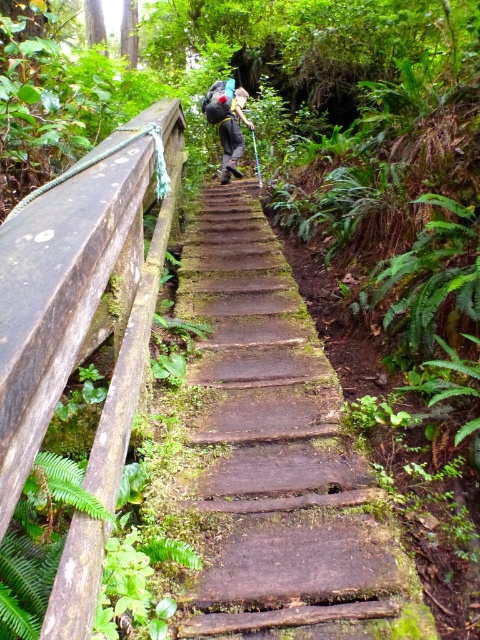
Is mossy wood stairs at center positioned behind matte black backpack at center?

No, it is not.

Is point (255, 609) farther from camera compared to point (203, 109)?

No, it is not.

Which is in front, point (308, 426) or point (214, 99)?

Point (308, 426) is in front.

Identify the location of mossy wood stairs at center. The width and height of the screenshot is (480, 640). (276, 451).

Can you confirm if brown weathered wood at left is bigger than matte black backpack at center?

Correct, brown weathered wood at left is larger in size than matte black backpack at center.

Does brown weathered wood at left appear on the left side of matte black backpack at center?

Indeed, brown weathered wood at left is positioned on the left side of matte black backpack at center.

Between point (8, 397) and point (202, 106), which one is positioned behind?

The point (202, 106) is behind.

You are a GUI agent. You are given a task and a screenshot of the screen. Output one action in this format:
    pyautogui.click(x=<x>, y=<y>)
    Task: Click on the brown weathered wood at left
    This screenshot has width=480, height=640.
    Given the screenshot: What is the action you would take?
    pyautogui.click(x=82, y=296)

Is mossy wood stairs at center wider than brown weathered wood at left?

Correct, the width of mossy wood stairs at center exceeds that of brown weathered wood at left.

Is mossy wood stairs at center to the right of brown weathered wood at left from the viewer's perspective?

Indeed, mossy wood stairs at center is positioned on the right side of brown weathered wood at left.

Does point (210, 621) come in front of point (154, 164)?

Yes, it is.

Find the location of a particular element. The height and width of the screenshot is (640, 480). mossy wood stairs at center is located at coordinates click(276, 451).